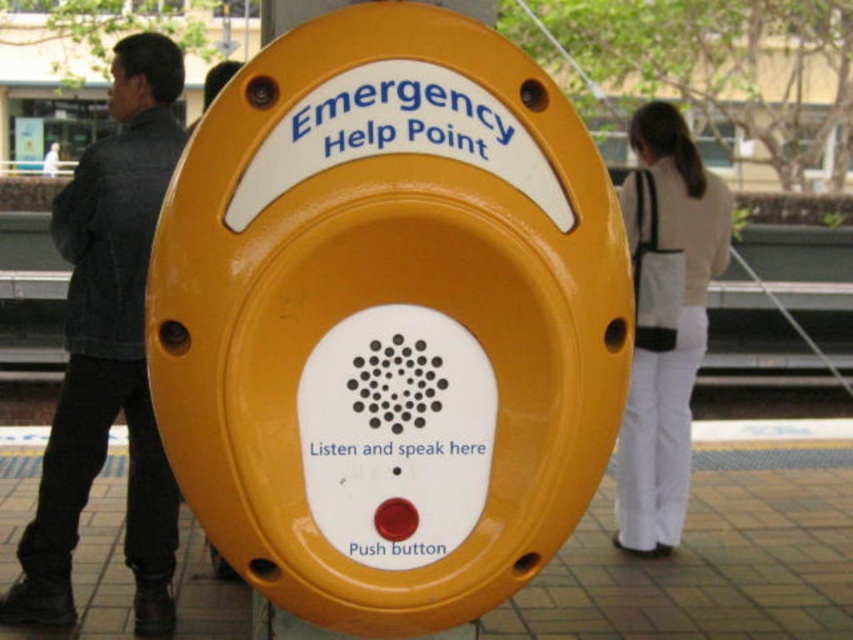
You are a security guard observing the scene. You notice two items in the foreground near the emergency help point device. Which item is bigger in size between the dark gray denim jacket at left and the white fabric bag at right?

The dark gray denim jacket at left is larger in size than the white fabric bag at right.

Based on the photo, you are standing in front of an emergency help point device and notice two items in the background. Which item is taller, the dark gray denim jacket at left or the white fabric bag at right?

The dark gray denim jacket at left is taller than the white fabric bag at right according to the description.